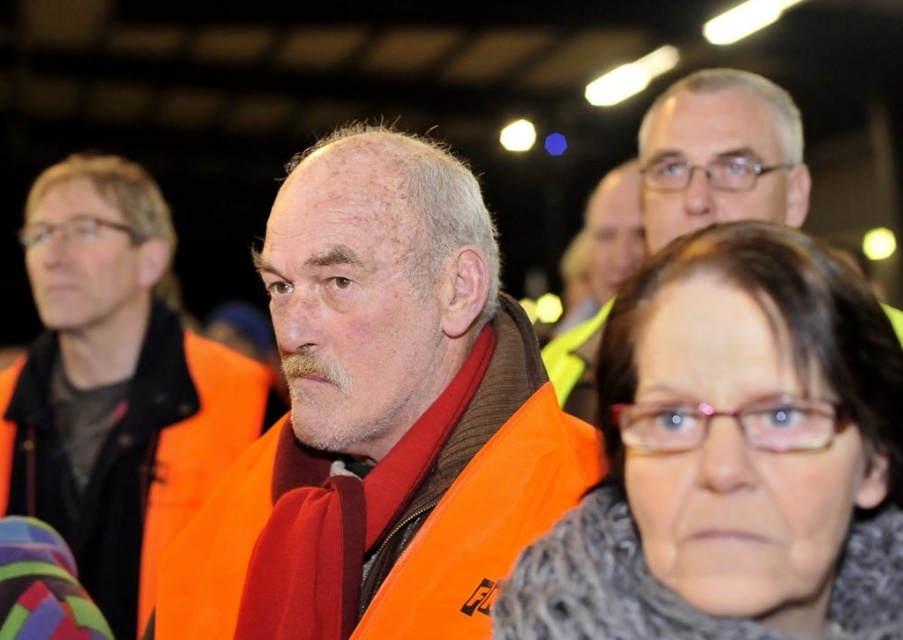
Question: Can you confirm if orange fabric vest at center is positioned above matte orange vest at center?

Choices:
 (A) no
 (B) yes

Answer: (B)

Question: Is matte orange vest at center wider than orange fabric vest at left?

Choices:
 (A) no
 (B) yes

Answer: (A)

Question: Estimate the real-world distances between objects in this image. Which object is farther from the orange fabric vest at left?

Choices:
 (A) orange fabric vest at center
 (B) matte orange vest at center

Answer: (B)

Question: Is matte orange vest at center wider than orange fabric vest at left?

Choices:
 (A) no
 (B) yes

Answer: (A)

Question: Which of the following is the farthest from the observer?

Choices:
 (A) (392, 291)
 (B) (135, 490)
 (C) (717, 456)
 (D) (599, 332)

Answer: (B)

Question: Which of the following is the closest to the observer?

Choices:
 (A) orange fabric vest at left
 (B) matte orange vest at center
 (C) matte orange vest at upper right

Answer: (B)